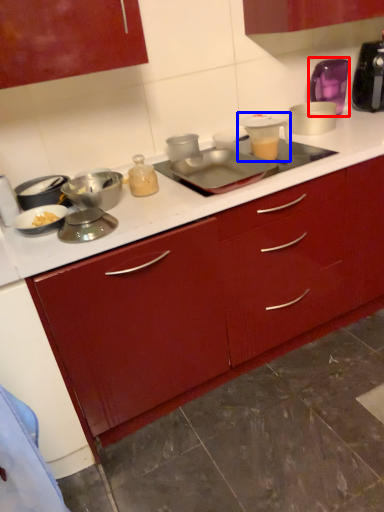
Question: Which point is closer to the camera, appliance (highlighted by a red box) or appliance (highlighted by a blue box)?

Choices:
 (A) appliance
 (B) appliance

Answer: (B)